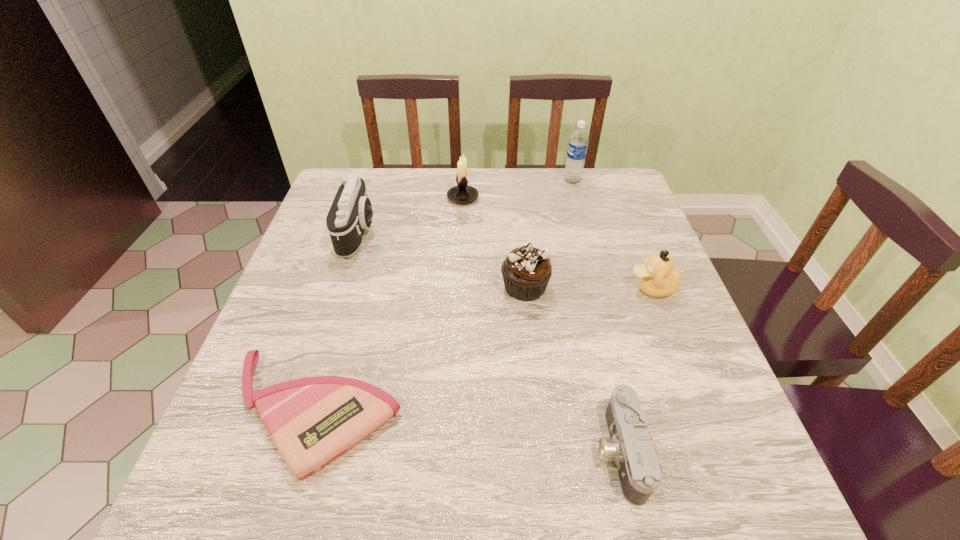
Locate an element on the screen. The height and width of the screenshot is (540, 960). vacant space in between the farther camera and the fourth object from left to right is located at coordinates (442, 260).

This screenshot has height=540, width=960. Find the location of `free area in between the cupcake and the nearer camera`. free area in between the cupcake and the nearer camera is located at coordinates (572, 369).

The width and height of the screenshot is (960, 540). Identify the location of vacant area between the taller camera and the shorter camera. (489, 342).

Where is `unoccupied position between the wristlet and the second shortest object`? The width and height of the screenshot is (960, 540). unoccupied position between the wristlet and the second shortest object is located at coordinates (467, 431).

Where is `free point between the tallest object and the cupcake`? The width and height of the screenshot is (960, 540). free point between the tallest object and the cupcake is located at coordinates (548, 234).

Locate an element on the screen. vacant area that lies between the wristlet and the sixth tallest object is located at coordinates (467, 431).

Where is `free space between the rightmost object and the tallest object`? The image size is (960, 540). free space between the rightmost object and the tallest object is located at coordinates (612, 234).

Where is `unoccupied area between the shorter camera and the water bottle`? unoccupied area between the shorter camera and the water bottle is located at coordinates (596, 316).

Where is `object that is the second nearest to the right camera`? object that is the second nearest to the right camera is located at coordinates (657, 278).

This screenshot has height=540, width=960. Identify the location of object that is the sixth nearest to the shortest object. (578, 143).